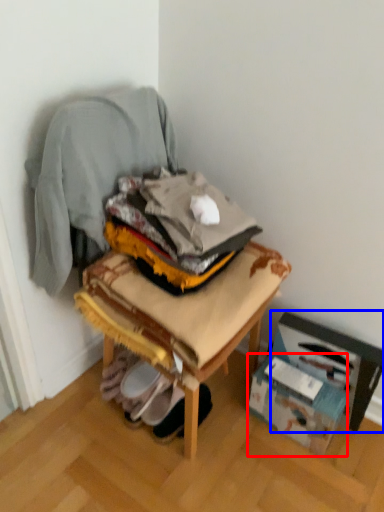
Question: Which point is further to the camera, cardboard box (highlighted by a red box) or cardboard box (highlighted by a blue box)?

Choices:
 (A) cardboard box
 (B) cardboard box

Answer: (A)